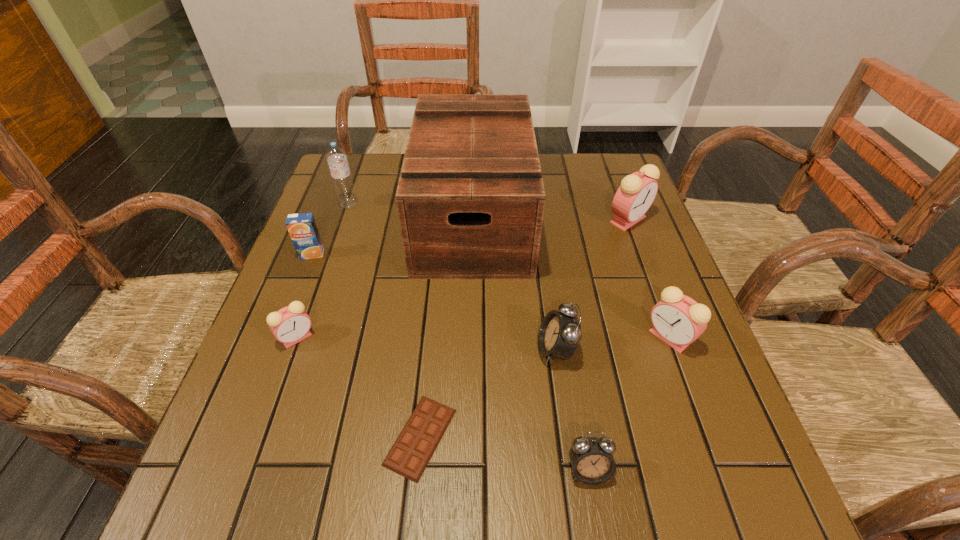
At what (x,y) coordinates should I click in order to perform the action: click on empty space between the tallest alarm clock and the box. Please return your answer as a coordinate pair (x, y). Looking at the image, I should click on (551, 218).

The width and height of the screenshot is (960, 540). What are the coordinates of `free space between the eighth shortest object and the orange_juice` in the screenshot? It's located at (330, 229).

Find the location of a particular element. Image resolution: width=960 pixels, height=540 pixels. vacant area that lies between the nearer white alarm clock and the shortest object is located at coordinates (504, 454).

Locate an element on the screen. This screenshot has height=540, width=960. free spot between the shortest object and the nearer white alarm clock is located at coordinates (504, 454).

The width and height of the screenshot is (960, 540). What are the coordinates of `free space between the eighth shortest object and the leftmost alarm clock` in the screenshot? It's located at (323, 271).

Image resolution: width=960 pixels, height=540 pixels. Identify the location of free space between the tallest object and the nearer white alarm clock. (531, 343).

The image size is (960, 540). I want to click on object that can be found as the closest to the farthest alarm clock, so click(x=470, y=199).

Select which object is the second closest to the blue orange_juice. Please provide its 2D coordinates. Your answer should be formatted as a tuple, i.e. [(x, y)], where the tuple contains the x and y coordinates of a point satisfying the conditions above.

[(290, 325)]

Where is `the fourth closest alarm clock to the orange_juice`? The image size is (960, 540). the fourth closest alarm clock to the orange_juice is located at coordinates (637, 191).

Select which alarm clock appears as the closest to the blue orange_juice. Please provide its 2D coordinates. Your answer should be formatted as a tuple, i.e. [(x, y)], where the tuple contains the x and y coordinates of a point satisfying the conditions above.

[(290, 325)]